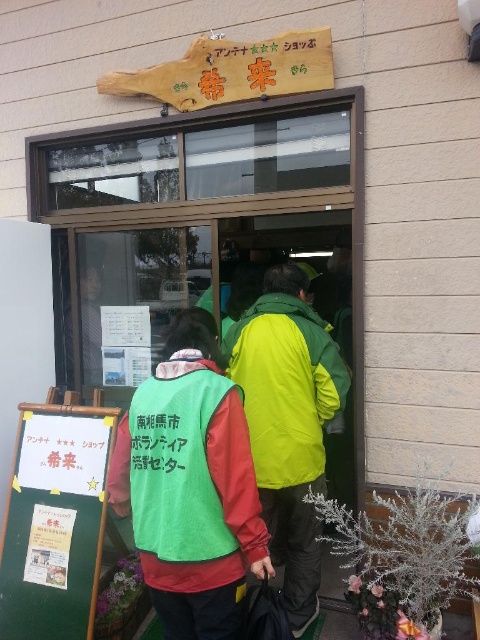
You are a visitor at the entrance and need to choose between two green items to wear for a guided tour. The green matte jacket at center and the green fabric vest at center are available. Which one is narrower and thus easier to move through the narrow corridors inside?

The green matte jacket at center has a lesser width compared to the green fabric vest at center, so it is narrower and easier to move through narrow corridors.

You are standing at the entrance of the building and want to move towards the point labeled as point (x=312, y=401). However, there is an obstacle at point (x=96, y=426). Will you be able to reach your destination without going around the obstacle?

Point (x=96, y=426) is behind point (x=312, y=401), so the obstacle at point (x=96, y=426) is not in your path. You can reach point (x=312, y=401) directly without needing to go around.

You are a visitor approaching the entrance and notice two green items at the center. Which one is taller between the green matte jacket at center and the green fabric vest at center?

The green matte jacket at center is taller than the green fabric vest at center.